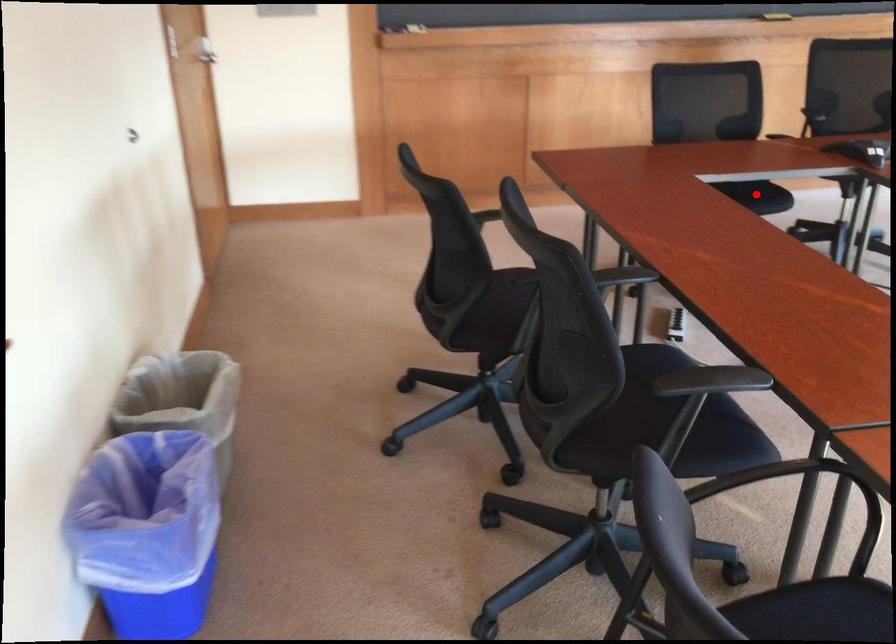
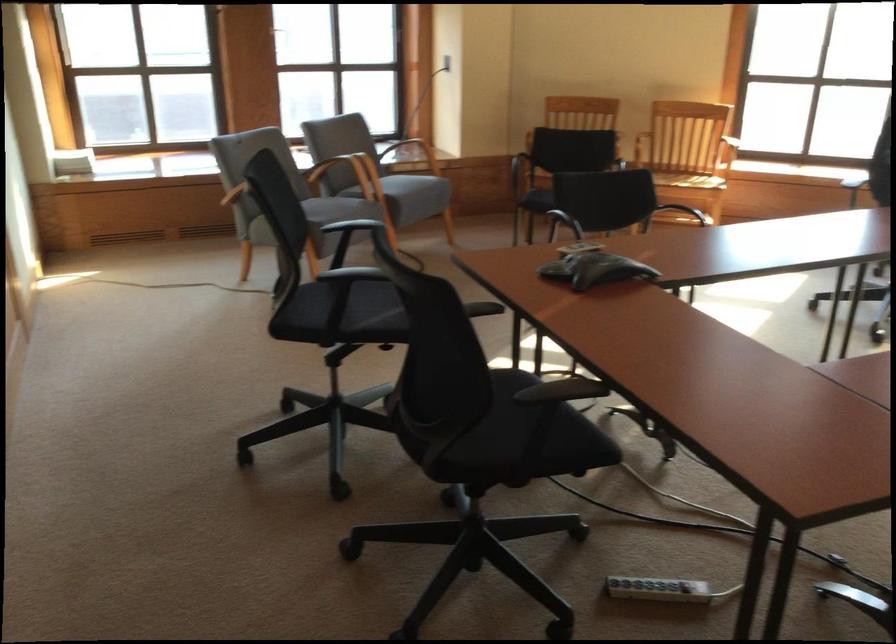
Question: I am providing you with two images of the same scene from different viewpoints. A red point is marked on the first image. At the location where the point appears in image 1, is it still visible in image 2?

Choices:
 (A) Yes
 (B) No

Answer: (B)